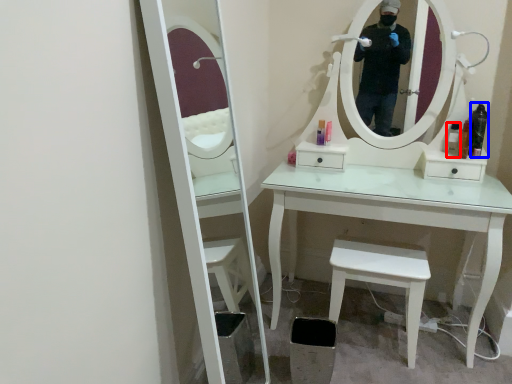
Question: Which point is closer to the camera, toiletry (highlighted by a red box) or toiletry (highlighted by a blue box)?

Choices:
 (A) toiletry
 (B) toiletry

Answer: (B)